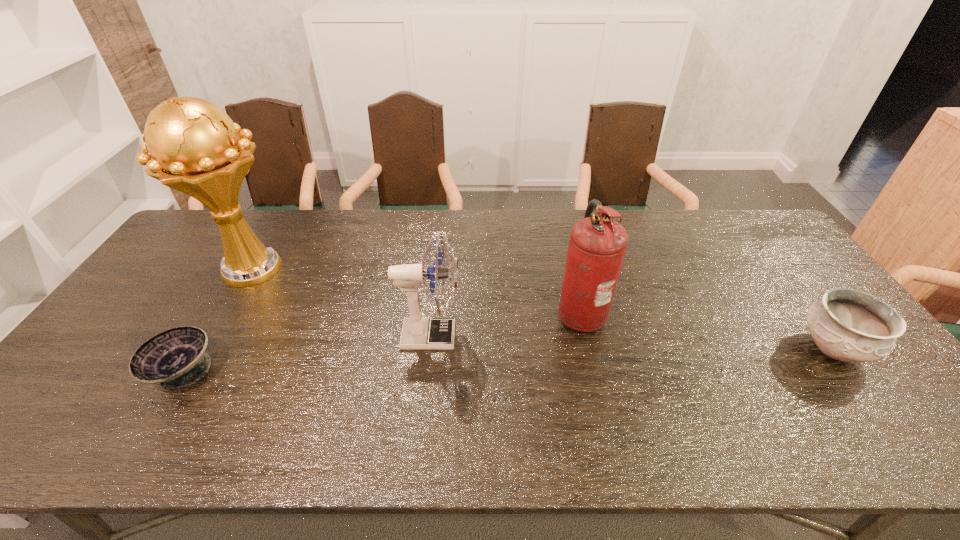
The width and height of the screenshot is (960, 540). Find the location of `free space between the rightmost object and the shortest object`. free space between the rightmost object and the shortest object is located at coordinates (508, 360).

Find the location of `empty space that is in between the pottery and the fourth object from left to right`. empty space that is in between the pottery and the fourth object from left to right is located at coordinates (707, 330).

Identify the location of unoccupied position between the fan and the tallest object. (341, 303).

This screenshot has height=540, width=960. I want to click on object that stands as the second closest to the bowl, so click(418, 333).

You are a GUI agent. You are given a task and a screenshot of the screen. Output one action in this format:
    pyautogui.click(x=<x>, y=<y>)
    Task: Click on the object that is the fourth nearest to the pottery
    The height and width of the screenshot is (540, 960).
    Given the screenshot: What is the action you would take?
    pyautogui.click(x=175, y=358)

Find the location of a particular element. This screenshot has width=960, height=540. vacant space that satisfies the following two spatial constraints: 1. on the front-facing side of the third tallest object; 2. on the left side of the pottery is located at coordinates (429, 348).

You are a GUI agent. You are given a task and a screenshot of the screen. Output one action in this format:
    pyautogui.click(x=<x>, y=<y>)
    Task: Click on the free space that satisfies the following two spatial constraints: 1. at the front of the pottery where the nozzle is aimed; 2. on the right side of the second object from right to left
    This screenshot has height=540, width=960.
    Given the screenshot: What is the action you would take?
    pyautogui.click(x=588, y=348)

The width and height of the screenshot is (960, 540). What are the coordinates of `free spot that satisfies the following two spatial constraints: 1. at the front of the pottery where the nozzle is aimed; 2. on the left side of the fourth object from left to right` in the screenshot? It's located at (588, 348).

The image size is (960, 540). I want to click on blank area in the image that satisfies the following two spatial constraints: 1. at the front of the rightmost object where the globe is prominent; 2. on the right side of the trophy_cup, so click(205, 348).